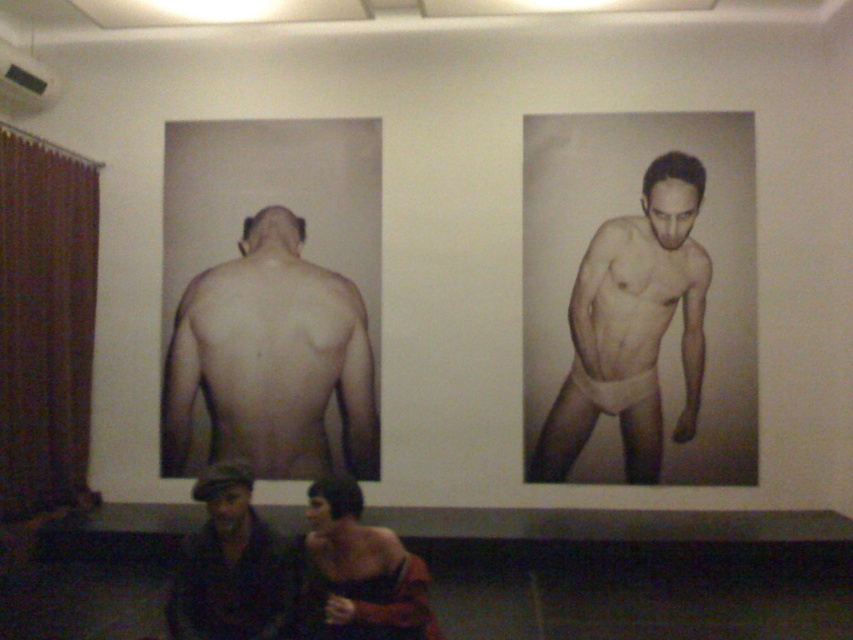
Does smooth skin back at center lie in front of dark brown leather jacket at lower left?

No, smooth skin back at center is further to the viewer.

Does smooth skin back at center appear on the left side of dark brown leather jacket at lower left?

Yes, smooth skin back at center is to the left of dark brown leather jacket at lower left.

Is point (291, 296) positioned behind point (216, 580)?

That is True.

Where is `smooth skin back at center`? smooth skin back at center is located at coordinates (270, 360).

Between matte beige underwear at right and smooth skin man at lower center, which one is positioned higher?

matte beige underwear at right is above.

Is matte beige underwear at right further to the viewer compared to smooth skin man at lower center?

Yes, it is behind smooth skin man at lower center.

Image resolution: width=853 pixels, height=640 pixels. What do you see at coordinates (631, 326) in the screenshot? I see `matte beige underwear at right` at bounding box center [631, 326].

Where is `matte beige underwear at right`? The width and height of the screenshot is (853, 640). matte beige underwear at right is located at coordinates (631, 326).

Is point (213, 273) behind point (608, 228)?

Yes, point (213, 273) is behind point (608, 228).

Locate an element on the screen. The height and width of the screenshot is (640, 853). smooth skin back at center is located at coordinates (270, 360).